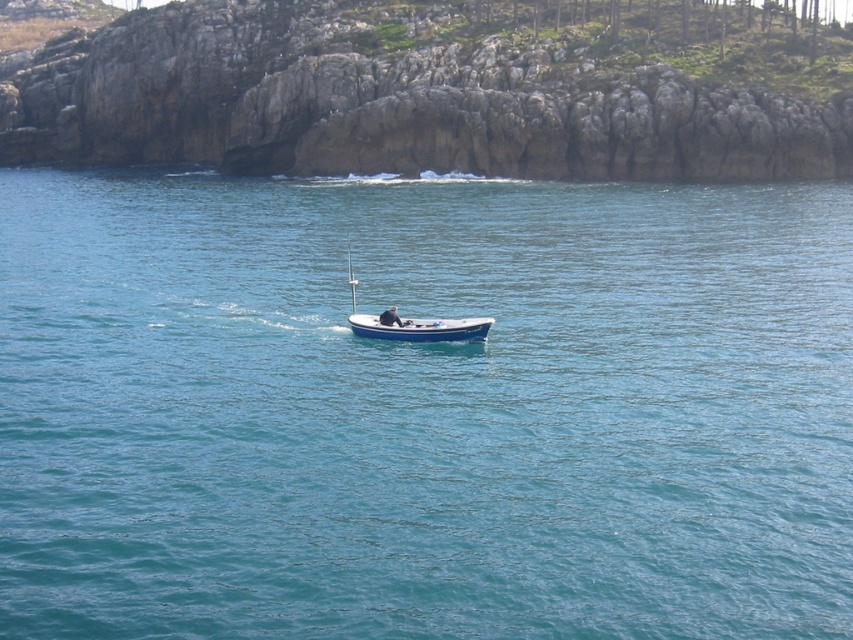
You are standing on the rocky coast and see the blue polished wood boat at center and the blue water at center. Which object is higher in the image?

The blue water at center is located above the blue polished wood boat at center, so the blue water at center is higher.

You are navigating a small boat and need to avoid shallow areas. The blue water at center is the deepest part. Where should you steer your boat to ensure safe passage?

You should steer your boat towards the blue water at center since it is located at point (422, 408), which indicates the deepest area for safe navigation.

You are a marine biologist studying the distribution of marine life around the blue polished wood boat at center. Based on the coordinates provided, can you determine the exact location of the boat in the image?

The blue polished wood boat at center is located at coordinates point (415, 323).